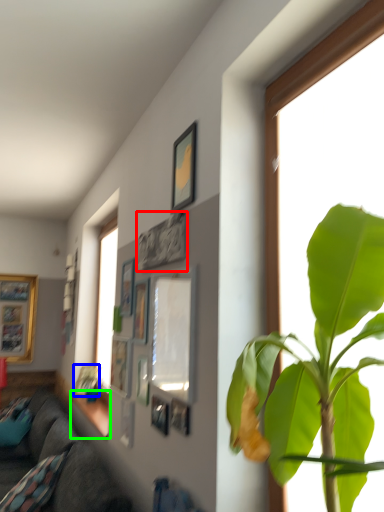
Question: Considering the real-world distances, which object is closest to picture frame (highlighted by a red box)? picture frame (highlighted by a blue box) or window sill (highlighted by a green box).

Choices:
 (A) picture frame
 (B) window sill

Answer: (B)